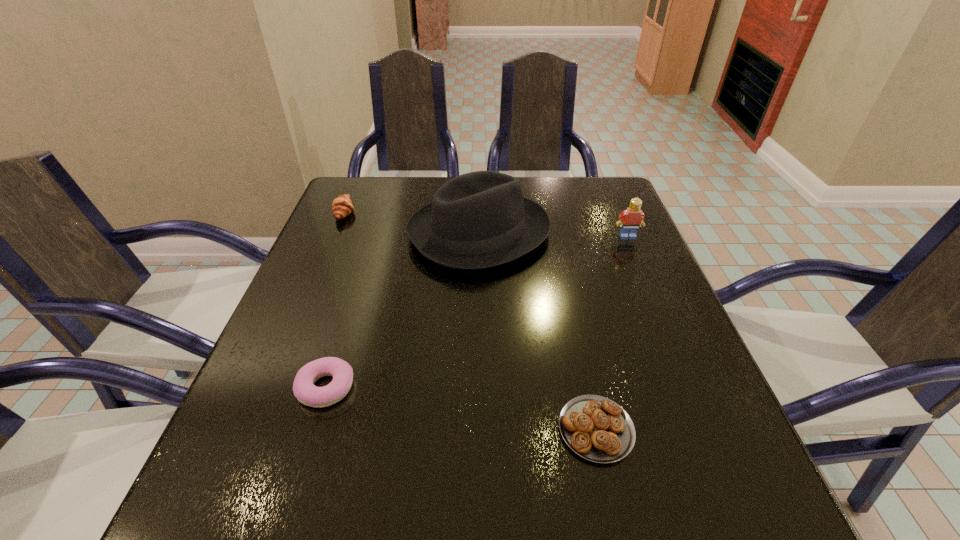
Where is `vacant space at the right edge of the desktop`? The image size is (960, 540). vacant space at the right edge of the desktop is located at coordinates (654, 327).

The width and height of the screenshot is (960, 540). Identify the location of blank space at the far left corner of the desktop. (386, 198).

Locate an element on the screen. This screenshot has height=540, width=960. vacant space at the far right corner of the desktop is located at coordinates (612, 202).

Find the location of a particular element. empty space that is in between the second pastry from right to left and the leftmost pastry is located at coordinates (335, 300).

Where is `vacant space in between the tallest object and the rightmost object`? Image resolution: width=960 pixels, height=540 pixels. vacant space in between the tallest object and the rightmost object is located at coordinates (553, 235).

Locate an element on the screen. This screenshot has width=960, height=540. blank region between the second pastry from right to left and the rightmost pastry is located at coordinates (461, 408).

In order to click on free space between the fourth shortest object and the rightmost pastry in this screenshot , I will do `click(612, 333)`.

Find the location of a particular element. Image resolution: width=960 pixels, height=540 pixels. vacant area that lies between the tallest pastry and the second object from left to right is located at coordinates (335, 300).

At what (x,y) coordinates should I click in order to perform the action: click on vacant point located between the rightmost pastry and the tallest object. Please return your answer as a coordinate pair (x, y). Image resolution: width=960 pixels, height=540 pixels. Looking at the image, I should click on (538, 331).

In order to click on vacant space that is in between the second tallest object and the fedora in this screenshot , I will do `click(553, 235)`.